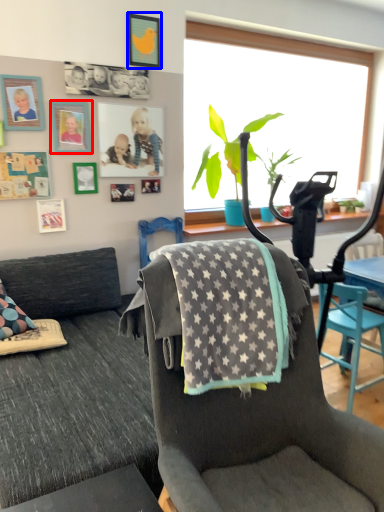
Question: Among these objects, which one is nearest to the camera, picture frame (highlighted by a red box) or picture frame (highlighted by a blue box)?

Choices:
 (A) picture frame
 (B) picture frame

Answer: (A)